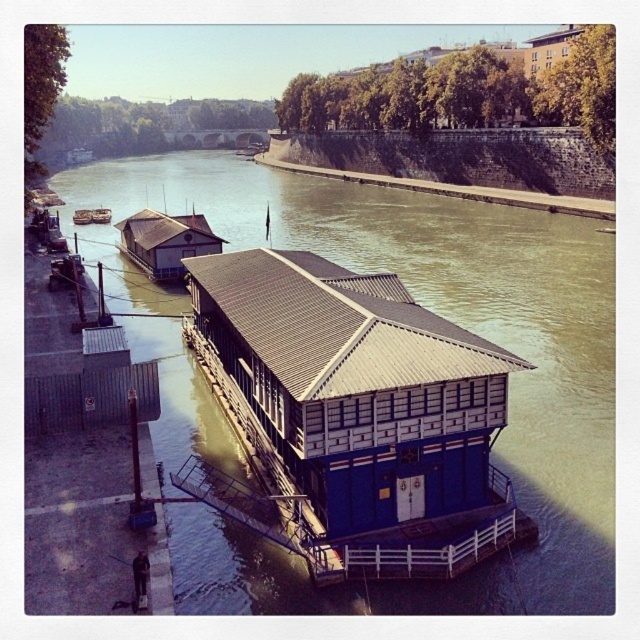
Which is below, wooden hut at upper left or wooden boat at left?

Positioned lower is wooden hut at upper left.

Image resolution: width=640 pixels, height=640 pixels. What do you see at coordinates (164, 241) in the screenshot? I see `wooden hut at upper left` at bounding box center [164, 241].

The width and height of the screenshot is (640, 640). I want to click on wooden hut at upper left, so click(x=164, y=241).

Can you confirm if blue wooden houseboat at center is positioned below blue wooden hut at center?

No, blue wooden houseboat at center is not below blue wooden hut at center.

Is point (612, 333) closer to viewer compared to point (397, 291)?

That is False.

Is point (593, 282) less distant than point (214, 323)?

No, it is behind (214, 323).

This screenshot has height=640, width=640. In order to click on blue wooden houseboat at center in this screenshot , I will do `click(433, 308)`.

Can you confirm if blue wooden houseboat at center is positioned below wooden hut at upper left?

Actually, blue wooden houseboat at center is above wooden hut at upper left.

Is blue wooden houseboat at center positioned behind wooden hut at upper left?

No, blue wooden houseboat at center is closer to the viewer.

Which is in front, point (417, 289) or point (145, 264)?

Positioned in front is point (417, 289).

Identify the location of blue wooden houseboat at center. (433, 308).